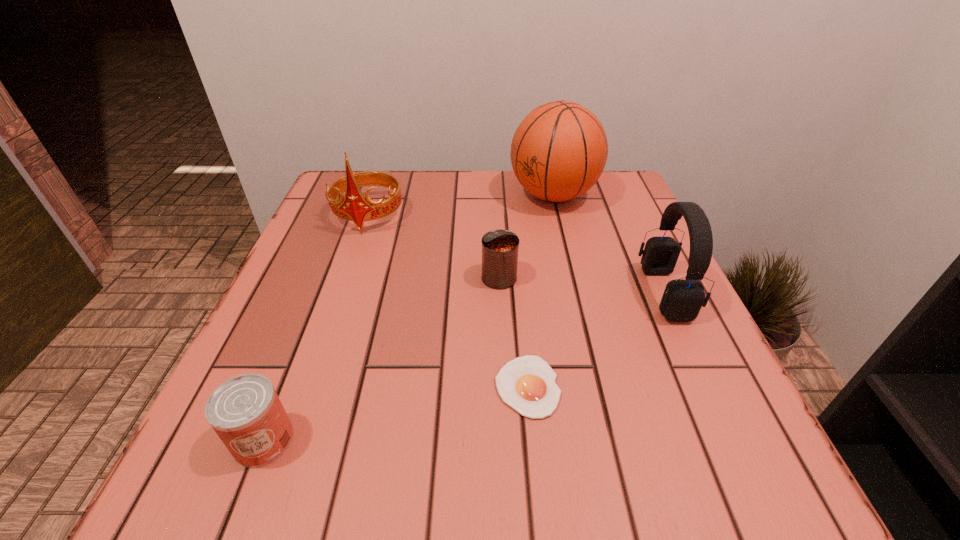
Identify the location of basketball. (558, 152).

You are a GUI agent. You are given a task and a screenshot of the screen. Output one action in this format:
    pyautogui.click(x=<x>, y=<y>)
    Task: Click on the tiara
    This screenshot has height=540, width=960.
    Given the screenshot: What is the action you would take?
    pyautogui.click(x=355, y=207)

This screenshot has width=960, height=540. In order to click on the rightmost object in this screenshot , I will do coord(682,299).

Locate an element on the screen. the third shortest object is located at coordinates (500, 248).

Identify the location of the taller can. (500, 248).

Find the location of a particular element. The width and height of the screenshot is (960, 540). the left can is located at coordinates (246, 413).

The width and height of the screenshot is (960, 540). I want to click on the nearer can, so click(246, 413).

Find the location of a particular element. egg yolk is located at coordinates (527, 383).

Where is `vacant space situated 0.400m on the front of the basketball`? Image resolution: width=960 pixels, height=540 pixels. vacant space situated 0.400m on the front of the basketball is located at coordinates (592, 356).

The width and height of the screenshot is (960, 540). I want to click on vacant space located on the front-facing side of the tiara, so click(x=341, y=294).